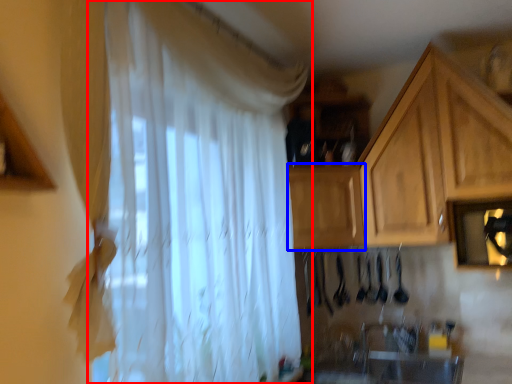
Question: Which object appears closest to the camera in this image, curtain (highlighted by a red box) or cabinetry (highlighted by a blue box)?

Choices:
 (A) curtain
 (B) cabinetry

Answer: (A)